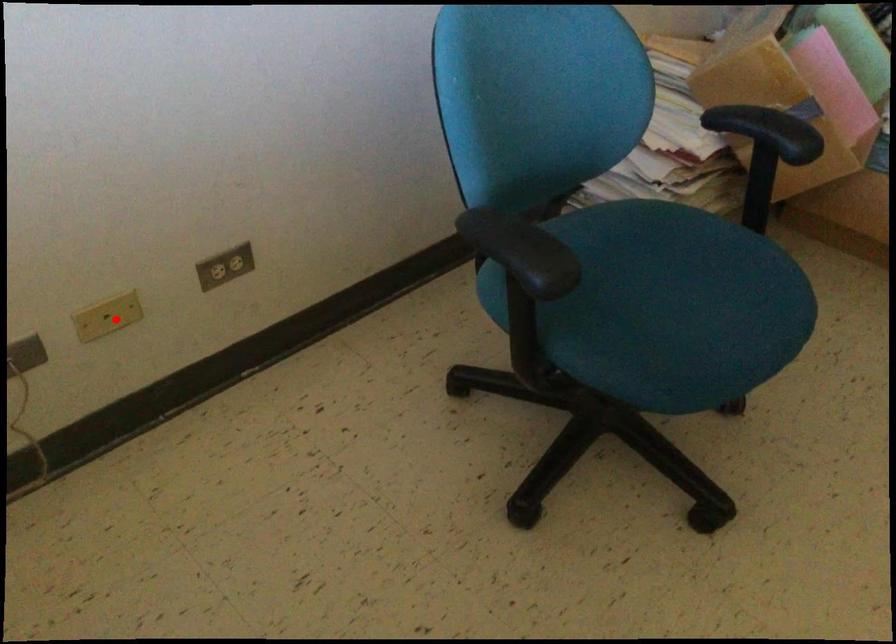
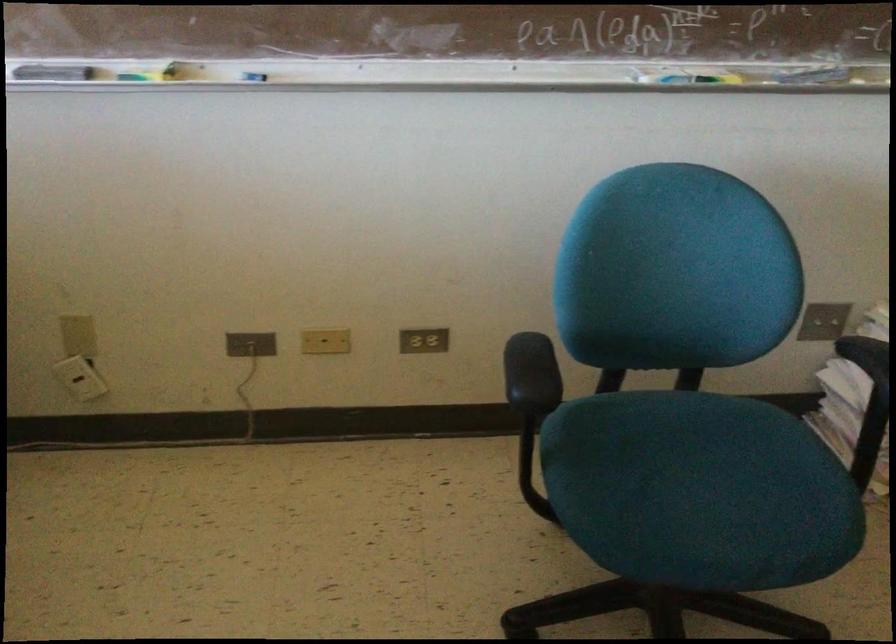
The point at the highlighted location is marked in the first image. Where is the corresponding point in the second image?

(325, 341)